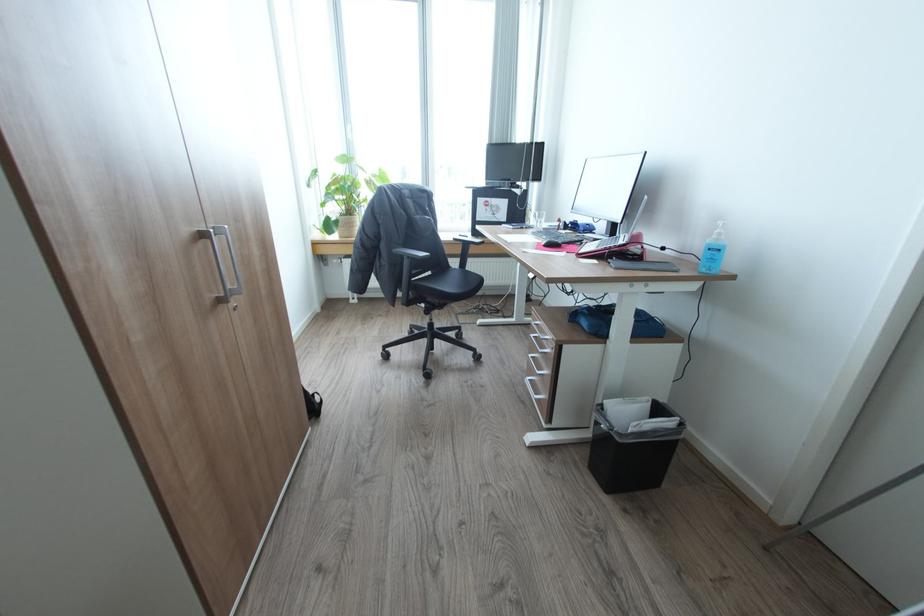
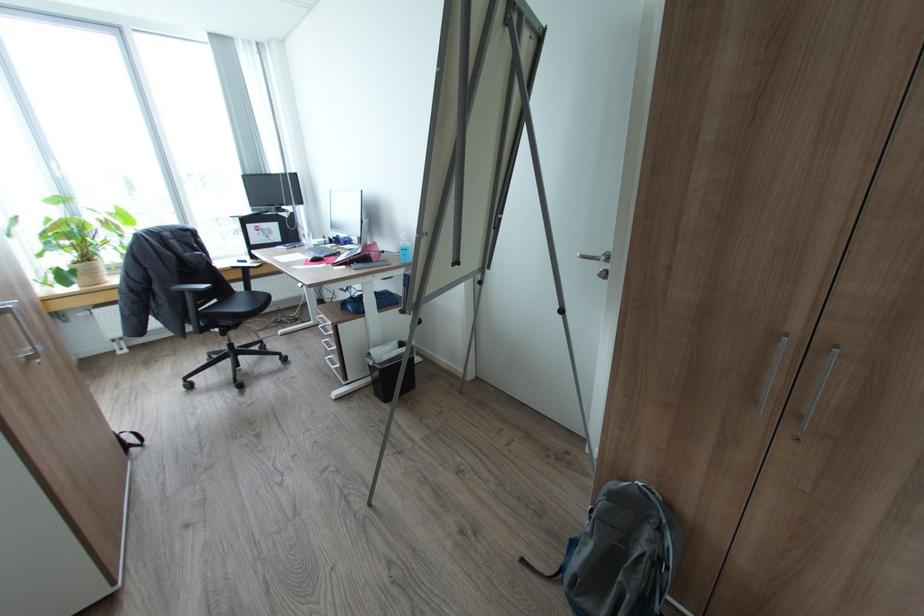
Locate, in the second image, the point that corresponds to pixel 548 243 in the first image.

(314, 259)